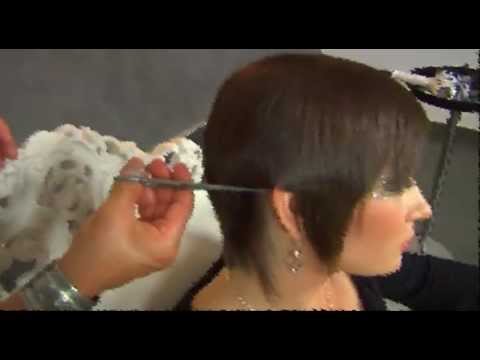
I want to click on wall, so click(x=134, y=94).